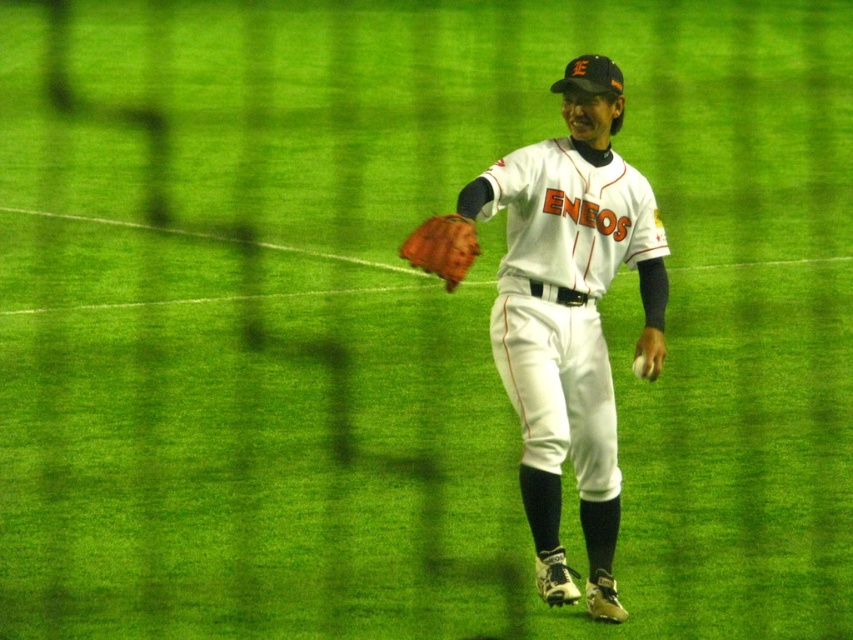
Does white matte baseball glove at center have a larger size compared to brown leather glove at center?

Indeed, white matte baseball glove at center has a larger size compared to brown leather glove at center.

Who is positioned more to the left, white matte baseball glove at center or brown leather glove at center?

Positioned to the left is brown leather glove at center.

At what (x,y) coordinates should I click in order to perform the action: click on white matte baseball glove at center. Please return your answer as a coordinate pair (x, y). Looking at the image, I should click on (570, 316).

Does brown leather glove at center have a lesser height compared to white matte baseball at center?

No, brown leather glove at center is not shorter than white matte baseball at center.

Where is `brown leather glove at center`? The width and height of the screenshot is (853, 640). brown leather glove at center is located at coordinates (442, 248).

Is point (451, 218) positioned after point (637, 369)?

No, (451, 218) is closer to viewer.

Locate an element on the screen. Image resolution: width=853 pixels, height=640 pixels. brown leather glove at center is located at coordinates (442, 248).

What do you see at coordinates (570, 316) in the screenshot?
I see `white matte baseball glove at center` at bounding box center [570, 316].

Which of these two, white matte baseball glove at center or white matte baseball at center, stands shorter?

With less height is white matte baseball at center.

Is point (590, 285) positioned before point (637, 358)?

No.

Locate an element on the screen. This screenshot has width=853, height=640. white matte baseball glove at center is located at coordinates (570, 316).